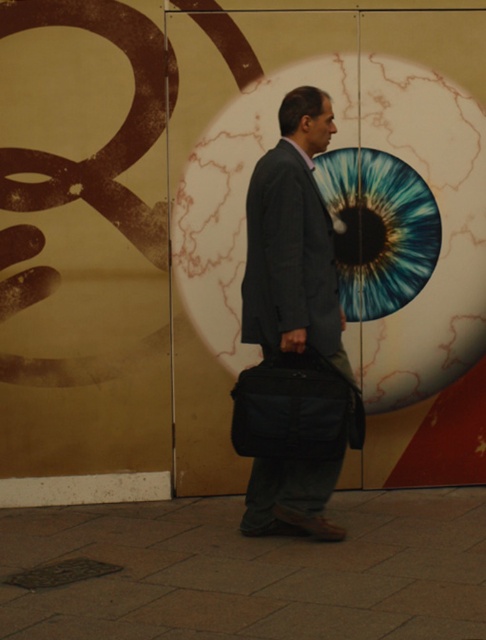
You are a security guard observing a man in the scene. You need to check if the dark gray suit at center is visible above the black fabric bag at center. Based on your observation, is this true?

Yes, the dark gray suit at center is located above the black fabric bag at center according to the description.

You are a tailor observing a man wearing a dark gray suit at center and carrying a black fabric bag at center. Which item has a larger width?

The black fabric bag at center has a larger width than the dark gray suit at center.